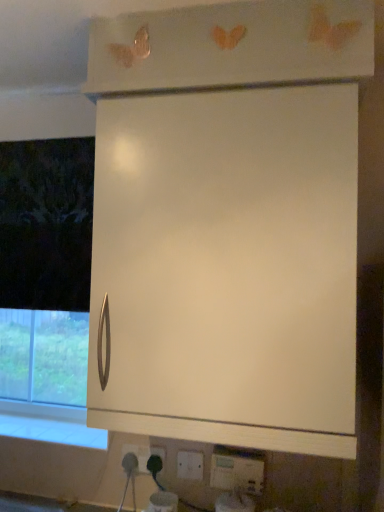
Locate an element on the screen. empty space that is ontop of white glossy window sill at lower left is located at coordinates (53, 432).